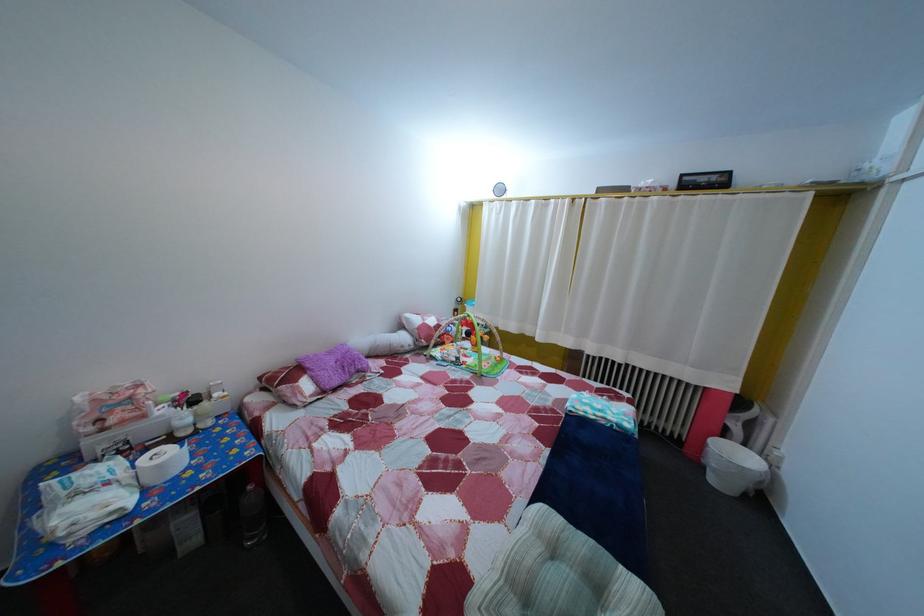
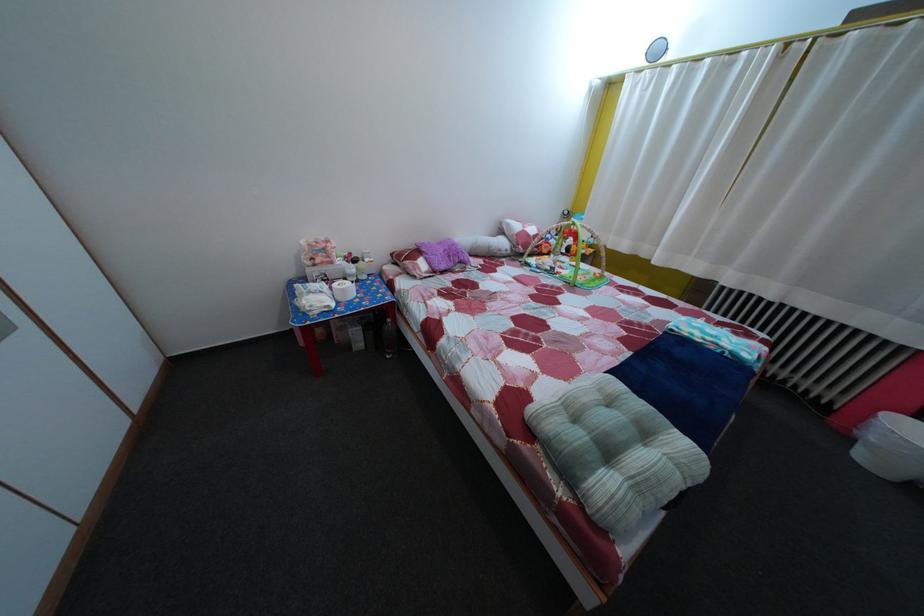
Find the pixel in the second image that matches pixel 138 450 in the first image.

(335, 284)